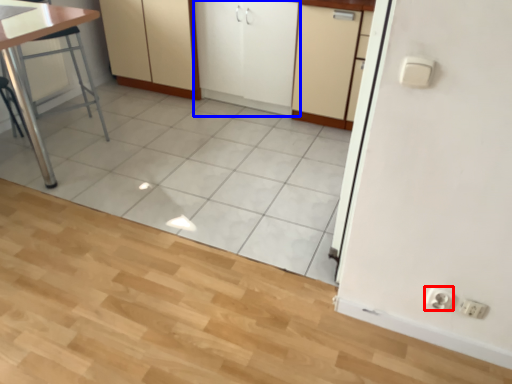
Question: Which of the following is the closest to the observer, electric outlet (highlighted by a red box) or cabinetry (highlighted by a blue box)?

Choices:
 (A) electric outlet
 (B) cabinetry

Answer: (A)